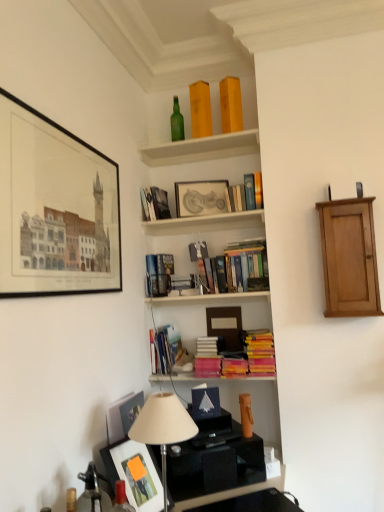
This screenshot has height=512, width=384. I want to click on vacant space positioned to the left of green glass bottle at upper center, so click(x=158, y=152).